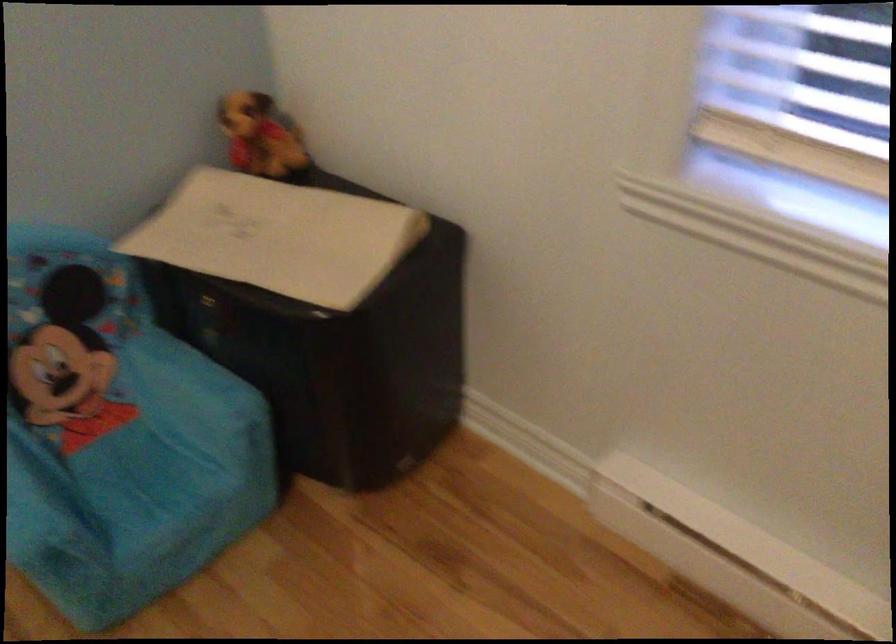
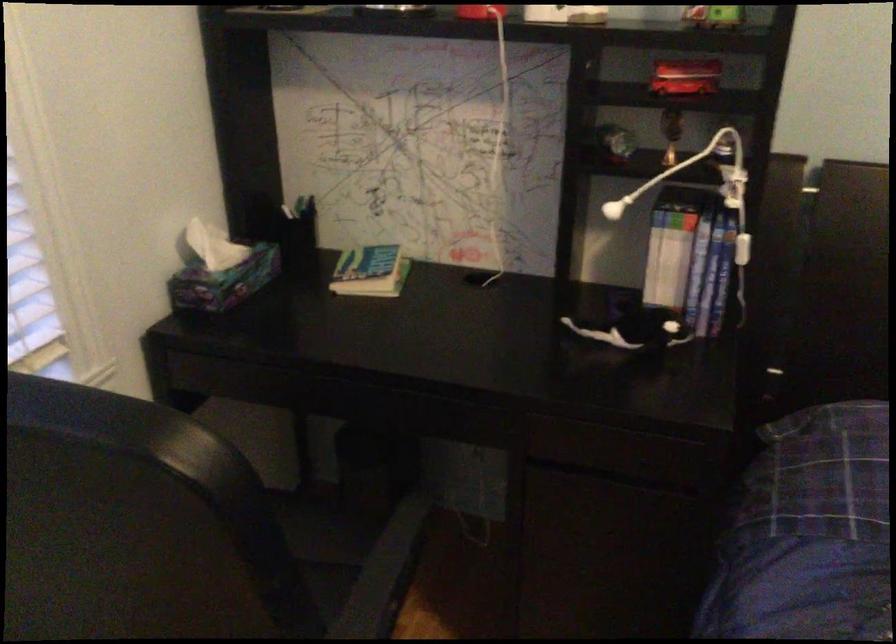
How did the camera likely rotate?

The camera's rotation is toward right-down.